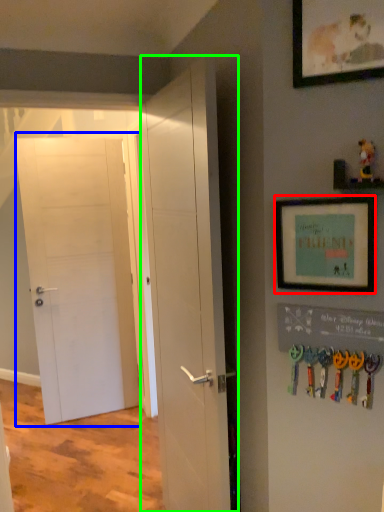
Question: Estimate the real-world distances between objects in this image. Which object is farther from picture frame (highlighted by a red box), door (highlighted by a blue box) or door (highlighted by a green box)?

Choices:
 (A) door
 (B) door

Answer: (A)